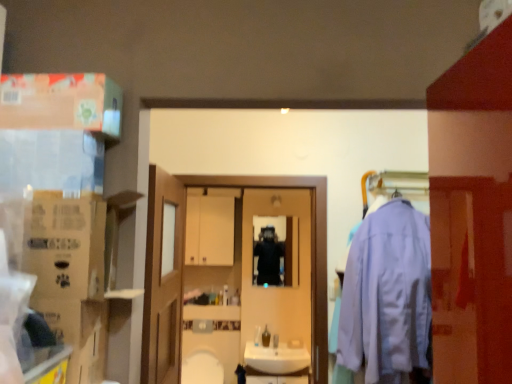
Question: Should I look upward or downward to see light blue fabric sweatshirt at right?

Choices:
 (A) down
 (B) up

Answer: (A)

Question: From a real-world perspective, does brown cardboard box at left, which is counted as the 1th cardboard box, starting from the top, stand above cardboard box at left, marked as the second cardboard box in a top-to-bottom arrangement?

Choices:
 (A) yes
 (B) no

Answer: (A)

Question: Can you confirm if brown cardboard box at left, which is counted as the 1th cardboard box, starting from the top, is smaller than cardboard box at left, marked as the second cardboard box in a top-to-bottom arrangement?

Choices:
 (A) yes
 (B) no

Answer: (B)

Question: Is brown cardboard box at left, which is counted as the 1th cardboard box, starting from the top, to the right of cardboard box at left, marked as the second cardboard box in a top-to-bottom arrangement, from the viewer's perspective?

Choices:
 (A) yes
 (B) no

Answer: (B)

Question: Is brown cardboard box at left, which is the 2th cardboard box from bottom to top, facing towards cardboard box at left, marked as the second cardboard box in a top-to-bottom arrangement?

Choices:
 (A) yes
 (B) no

Answer: (B)

Question: Is brown cardboard box at left, which is the 2th cardboard box from bottom to top, at the left side of cardboard box at left, marked as the second cardboard box in a top-to-bottom arrangement?

Choices:
 (A) yes
 (B) no

Answer: (A)

Question: Can you confirm if brown cardboard box at left, which is counted as the 1th cardboard box, starting from the top, is wider than cardboard box at left, marked as the second cardboard box in a top-to-bottom arrangement?

Choices:
 (A) yes
 (B) no

Answer: (A)

Question: Is white glossy sink at center positioned with its back to black matte jacket at center?

Choices:
 (A) yes
 (B) no

Answer: (B)

Question: Does white glossy sink at center appear on the left side of black matte jacket at center?

Choices:
 (A) yes
 (B) no

Answer: (A)

Question: Can you confirm if white glossy sink at center is taller than black matte jacket at center?

Choices:
 (A) yes
 (B) no

Answer: (B)

Question: Considering the relative sizes of white glossy sink at center and black matte jacket at center in the image provided, is white glossy sink at center bigger than black matte jacket at center?

Choices:
 (A) no
 (B) yes

Answer: (B)

Question: Is white glossy sink at center far from black matte jacket at center?

Choices:
 (A) yes
 (B) no

Answer: (B)

Question: Does white glossy sink at center have a greater width compared to black matte jacket at center?

Choices:
 (A) yes
 (B) no

Answer: (A)

Question: Is white glossy sink at center smaller than wooden door at center?

Choices:
 (A) yes
 (B) no

Answer: (A)